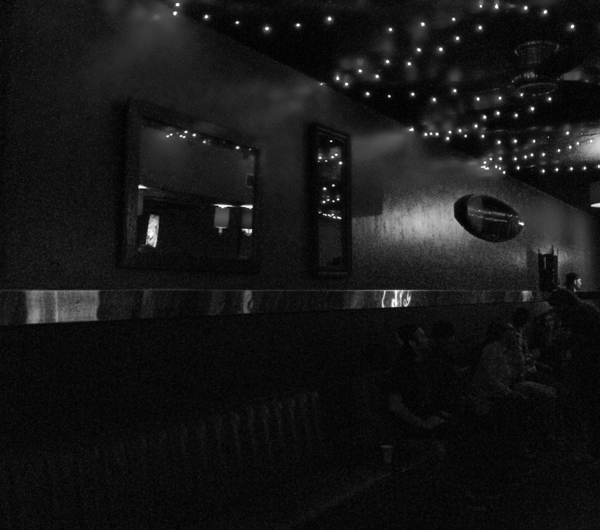
Identify the location of bench seating, vinyl. [x=262, y=423].